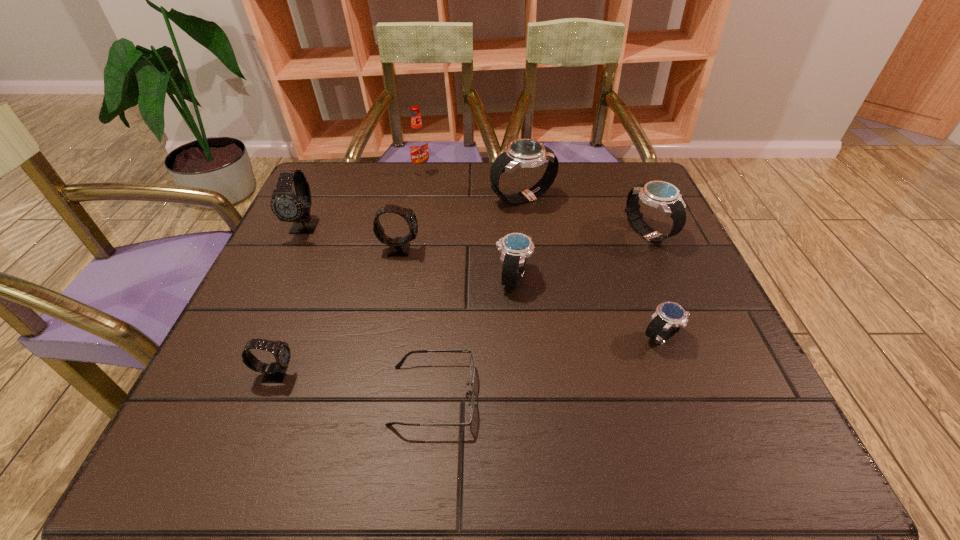
The width and height of the screenshot is (960, 540). In order to click on vacant space located on the right of the second nearest silver watch in this screenshot , I will do `click(667, 278)`.

Where is `vacant space located on the face of the smallest gray watch`? This screenshot has width=960, height=540. vacant space located on the face of the smallest gray watch is located at coordinates (402, 374).

The image size is (960, 540). In order to click on vacant space located on the back of the sixth farthest watch in this screenshot , I will do `click(640, 281)`.

Where is `vacant space situated on the front-facing side of the spectacles`? vacant space situated on the front-facing side of the spectacles is located at coordinates (521, 395).

The height and width of the screenshot is (540, 960). I want to click on root beer that is at the far edge, so click(x=418, y=142).

This screenshot has height=540, width=960. Identify the location of watch located at the far edge. (525, 153).

The image size is (960, 540). What are the coordinates of `object that is at the near edge` in the screenshot? It's located at (472, 368).

In the image, there is a desktop. Identify the location of vacant space at the far edge. The image size is (960, 540). (441, 187).

Where is `free region at the near edge of the desktop`? The height and width of the screenshot is (540, 960). free region at the near edge of the desktop is located at coordinates (537, 452).

Where is `vacant area at the left edge of the desktop`? vacant area at the left edge of the desktop is located at coordinates (336, 236).